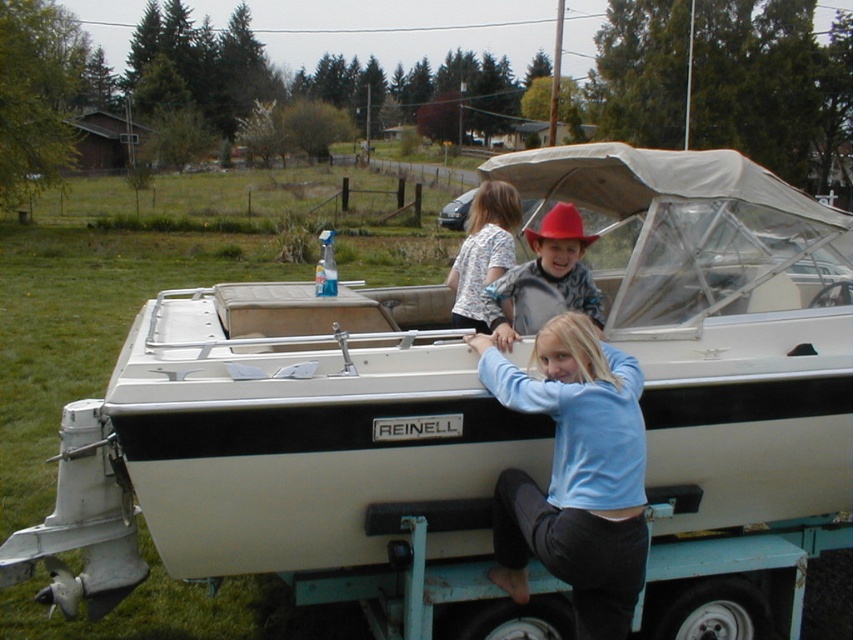
Question: Which of the following is the closest to the observer?

Choices:
 (A) white cotton shirt at upper center
 (B) matte red cowboy hat at center

Answer: (B)

Question: Where is light blue sweater at center located in relation to matte red cowboy hat at center in the image?

Choices:
 (A) above
 (B) below

Answer: (B)

Question: Which point is farther to the camera?

Choices:
 (A) (602, 488)
 (B) (506, 340)

Answer: (B)

Question: Estimate the real-world distances between objects in this image. Which object is closer to the matte red cowboy hat at center?

Choices:
 (A) white cotton shirt at upper center
 (B) light blue sweater at center

Answer: (A)

Question: Does light blue sweater at center have a larger size compared to matte red cowboy hat at center?

Choices:
 (A) yes
 (B) no

Answer: (A)

Question: Can you confirm if light blue sweater at center is positioned to the right of white cotton shirt at upper center?

Choices:
 (A) yes
 (B) no

Answer: (B)